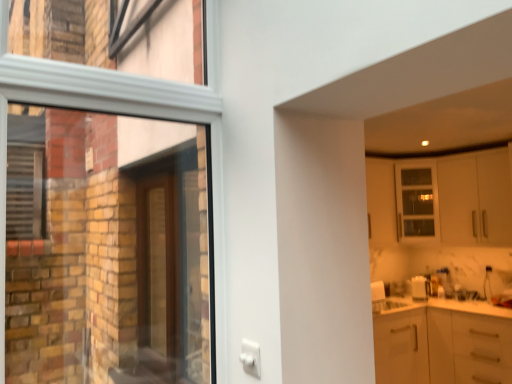
Question: Does brown wooden door at left have a lesser height compared to white matte cabinet at upper right?

Choices:
 (A) no
 (B) yes

Answer: (A)

Question: Does brown wooden door at left have a smaller size compared to white matte cabinet at upper right?

Choices:
 (A) no
 (B) yes

Answer: (B)

Question: Considering the relative sizes of brown wooden door at left and white matte cabinet at upper right in the image provided, is brown wooden door at left wider than white matte cabinet at upper right?

Choices:
 (A) yes
 (B) no

Answer: (B)

Question: Is brown wooden door at left taller than white matte cabinet at upper right?

Choices:
 (A) yes
 (B) no

Answer: (A)

Question: Is brown wooden door at left outside of white matte cabinet at upper right?

Choices:
 (A) no
 (B) yes

Answer: (B)

Question: From the image's perspective, would you say brown wooden door at left is positioned over white matte cabinet at upper right?

Choices:
 (A) no
 (B) yes

Answer: (A)

Question: From the image's perspective, is white matte cabinet at upper right beneath brown wooden door at left?

Choices:
 (A) yes
 (B) no

Answer: (B)

Question: From a real-world perspective, is white matte cabinet at upper right on top of brown wooden door at left?

Choices:
 (A) yes
 (B) no

Answer: (A)

Question: From the image's perspective, would you say white matte cabinet at upper right is positioned over brown wooden door at left?

Choices:
 (A) yes
 (B) no

Answer: (A)

Question: Is white matte cabinet at upper right located outside brown wooden door at left?

Choices:
 (A) yes
 (B) no

Answer: (A)

Question: Can you confirm if white matte cabinet at upper right is thinner than brown wooden door at left?

Choices:
 (A) no
 (B) yes

Answer: (A)

Question: Considering the relative sizes of white matte cabinet at upper right and brown wooden door at left in the image provided, is white matte cabinet at upper right smaller than brown wooden door at left?

Choices:
 (A) no
 (B) yes

Answer: (A)

Question: Is point (463, 215) positioned closer to the camera than point (152, 249)?

Choices:
 (A) closer
 (B) farther

Answer: (B)